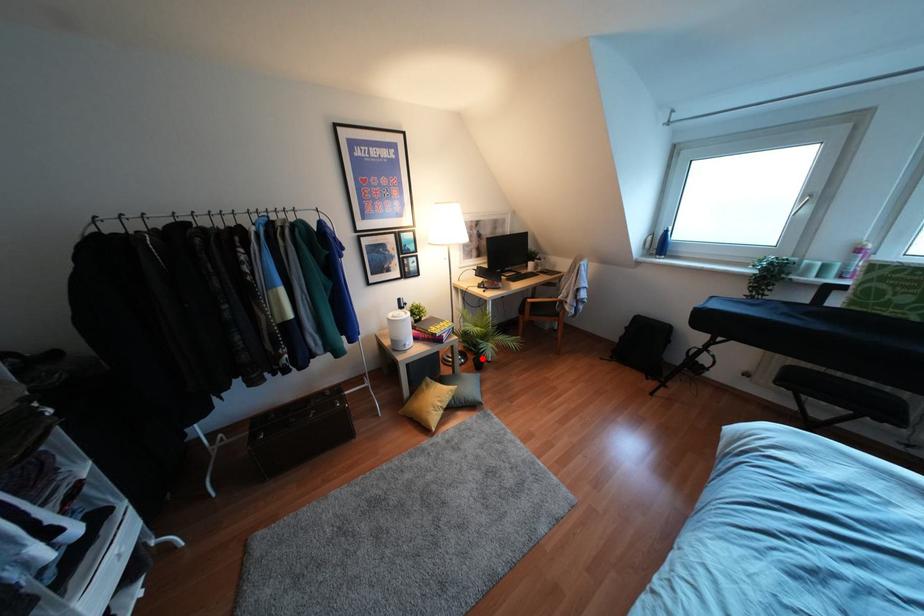
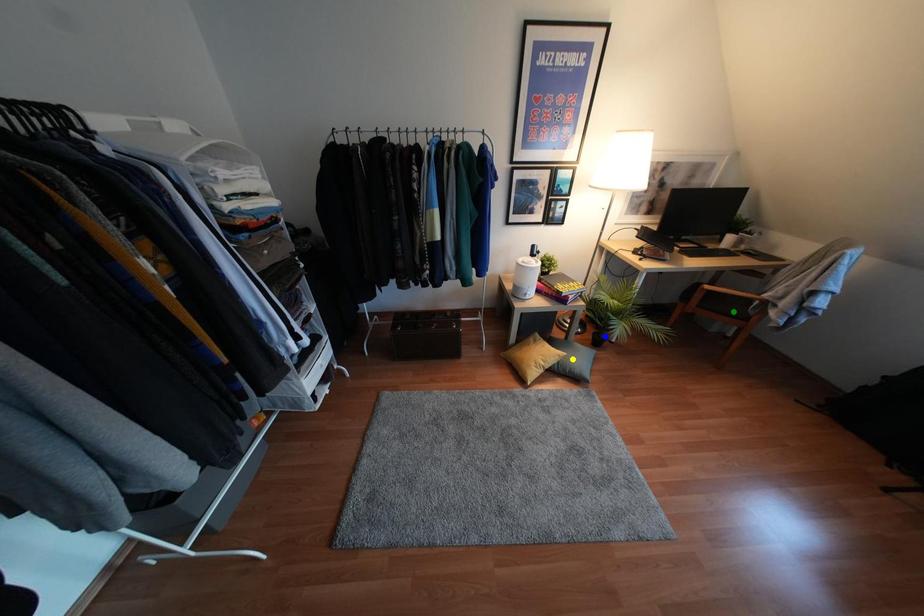
Question: I am providing you with two images of the same scene from different viewpoints. A red point is marked on the first image. You are given multiple points on the second image. Which point in image 2 is actually the same real-world point as the red point in image 1?

Choices:
 (A) green point
 (B) blue point
 (C) yellow point

Answer: (B)